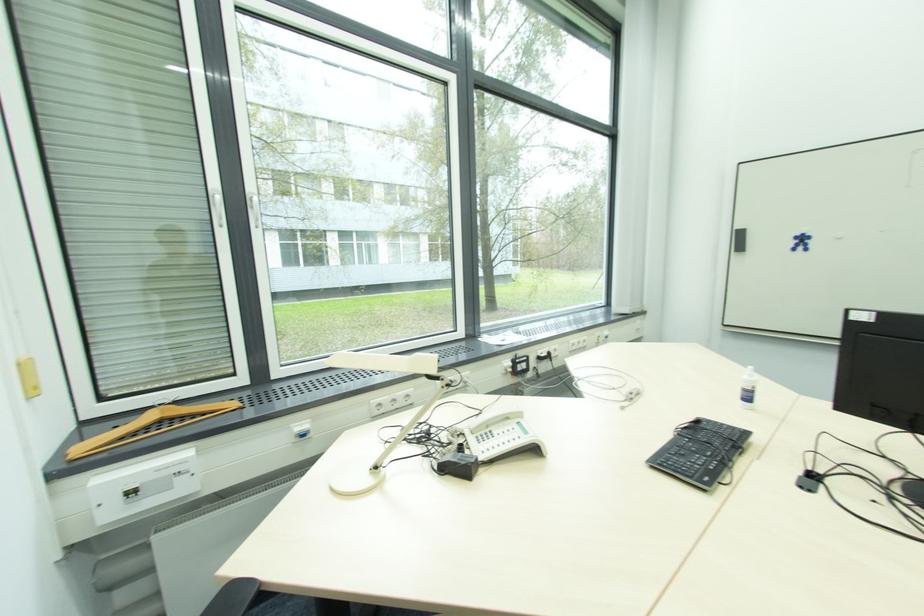
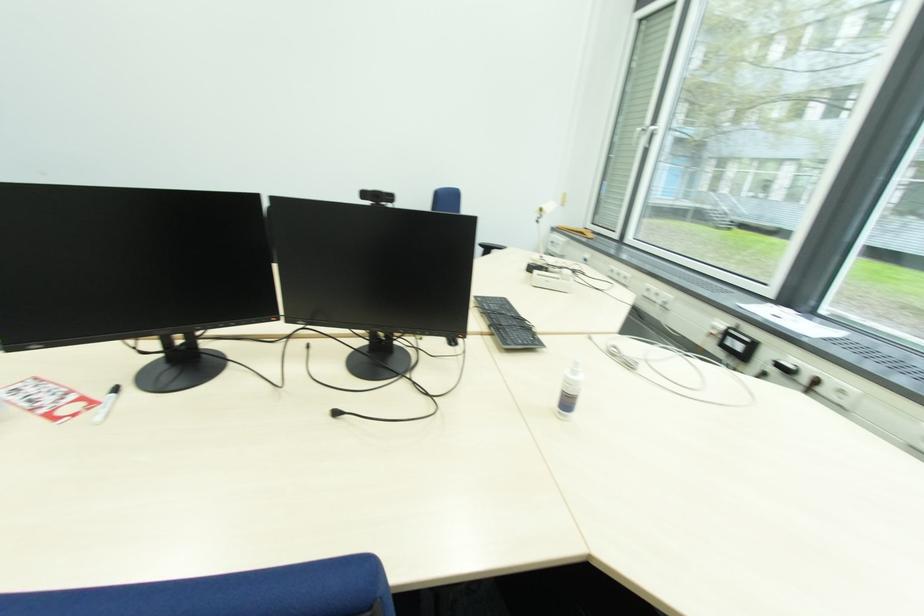
Find the pixel in the second image that matches [521,363] in the first image.

(734, 333)